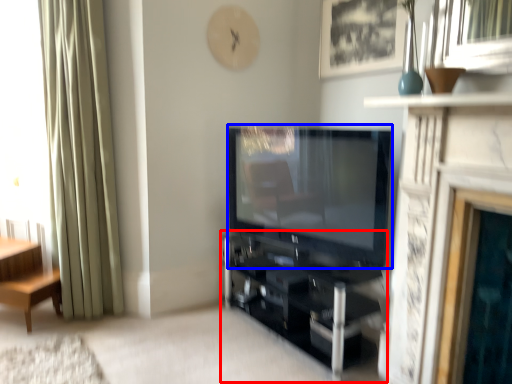
Question: Which object is further to the camera taking this photo, shelf (highlighted by a red box) or television (highlighted by a blue box)?

Choices:
 (A) shelf
 (B) television

Answer: (A)